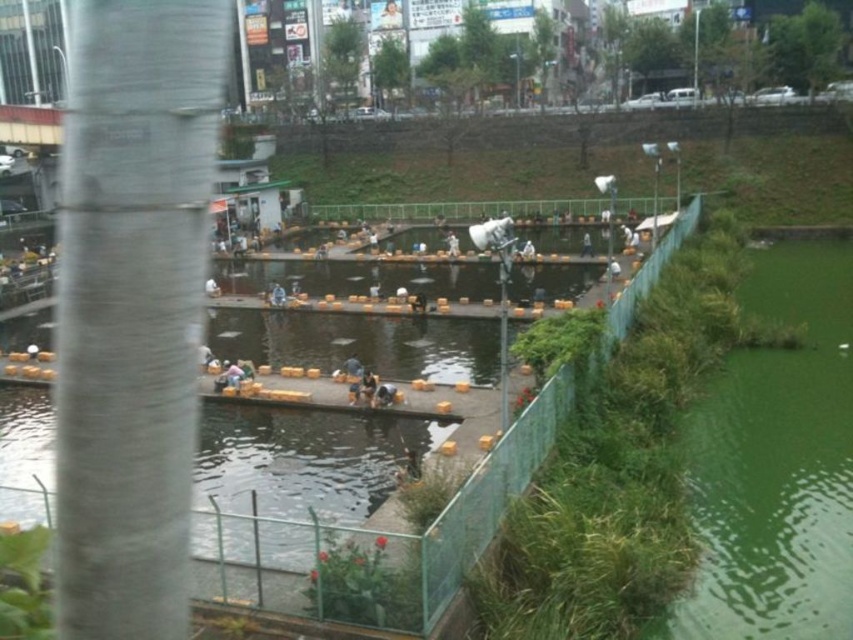
Question: Which point appears closest to the camera in this image?

Choices:
 (A) pyautogui.click(x=346, y=362)
 (B) pyautogui.click(x=714, y=515)
 (C) pyautogui.click(x=228, y=364)

Answer: (B)

Question: Is the position of green liquid water at lower right less distant than that of light brown wooden chair at center?

Choices:
 (A) no
 (B) yes

Answer: (B)

Question: Is green liquid water at lower right smaller than light brown wooden chair at center?

Choices:
 (A) yes
 (B) no

Answer: (B)

Question: Which point is farther to the camera?

Choices:
 (A) (351, 371)
 (B) (229, 369)

Answer: (A)

Question: Which point is farther to the camera?

Choices:
 (A) dark blue fabric person at center
 (B) green liquid water at lower right

Answer: (A)

Question: Is green liquid water at lower right thinner than dark blue fabric person at center?

Choices:
 (A) yes
 (B) no

Answer: (B)